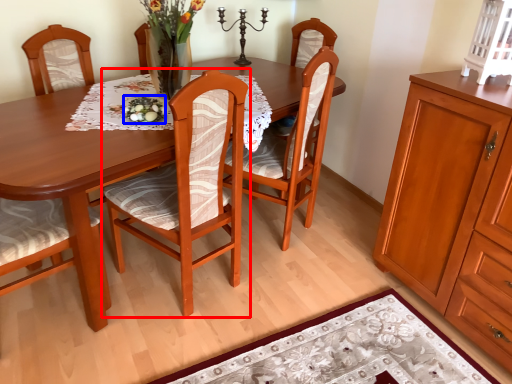
Question: Which point is further to the camera, chair (highlighted by a red box) or food (highlighted by a blue box)?

Choices:
 (A) chair
 (B) food

Answer: (B)